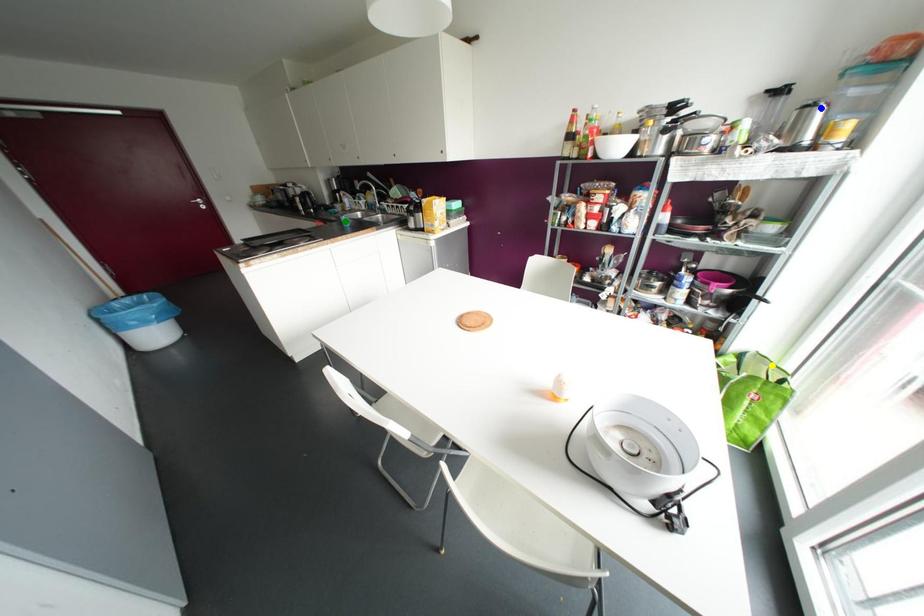
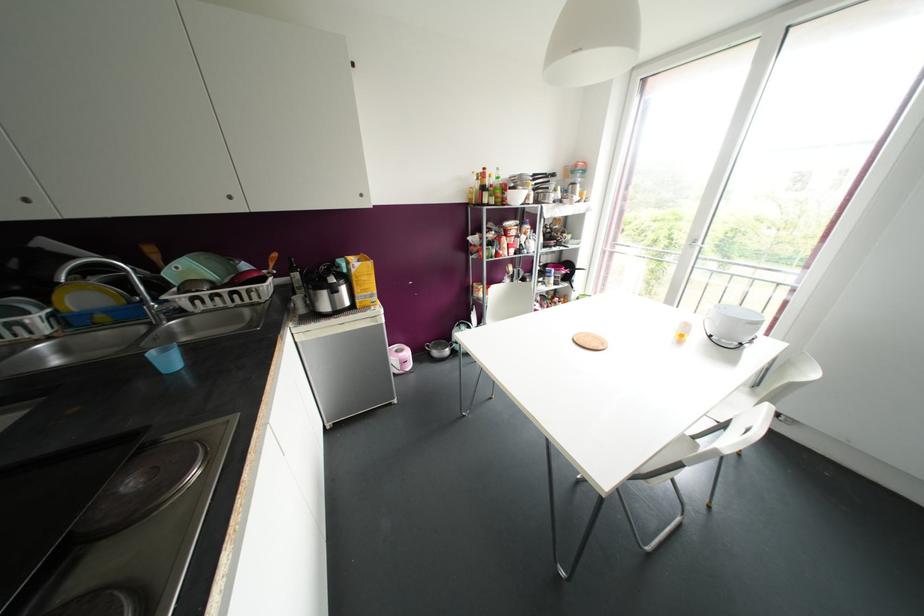
I am providing you with two images of the same scene from different viewpoints. Three points are marked in image1. Which point corresponds to a part or object that is occluded in image2?In image1, three points are marked. Which of them correspond to a part or object that is occluded in image2?Among the three points shown in image1, which one corresponds to a part or object that is no longer visible due to occlusion in image2?

Invisible in image2: yellow point.